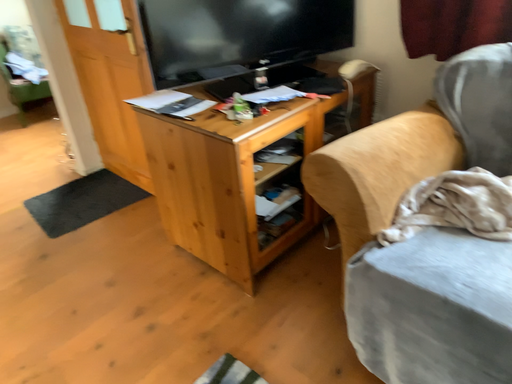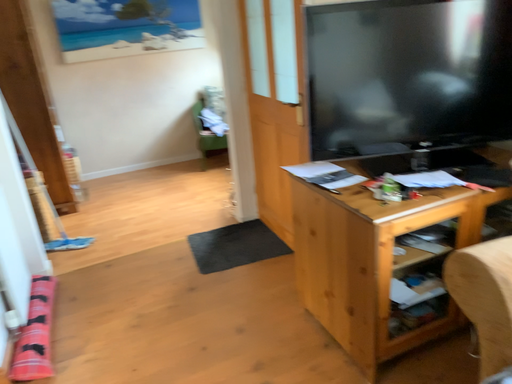
Question: Which way did the camera rotate in the video?

Choices:
 (A) rotated downward
 (B) rotated upward

Answer: (B)